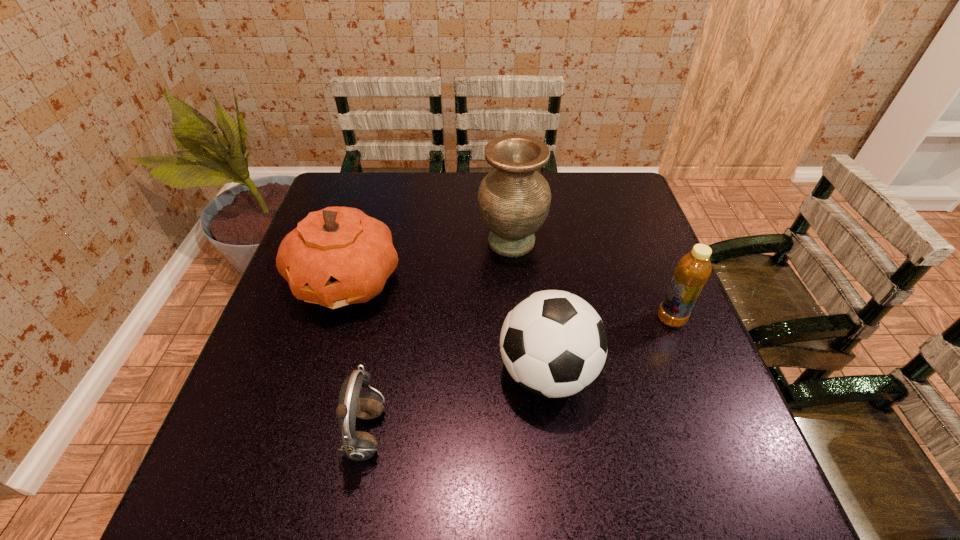
Where is `object that is at the near edge`? object that is at the near edge is located at coordinates (356, 445).

At what (x,y) coordinates should I click in order to perform the action: click on object situated at the left edge. Please return your answer as a coordinate pair (x, y). This screenshot has height=540, width=960. Looking at the image, I should click on (338, 256).

The image size is (960, 540). Find the location of `object that is at the right edge`. object that is at the right edge is located at coordinates (693, 270).

This screenshot has width=960, height=540. In the image, there is a desktop. What are the coordinates of `vacant space at the far edge` in the screenshot? It's located at click(x=566, y=199).

In the image, there is a desktop. Where is `blank space at the near edge`? Image resolution: width=960 pixels, height=540 pixels. blank space at the near edge is located at coordinates (388, 489).

What are the coordinates of `vacant area at the left edge of the desktop` in the screenshot? It's located at (252, 429).

Find the location of a particular element. This screenshot has height=540, width=960. free point at the far left corner is located at coordinates (354, 176).

Where is `blank space at the near left corner`? blank space at the near left corner is located at coordinates (261, 464).

Identify the location of blank space at the far right corner of the desktop. This screenshot has width=960, height=540. (629, 187).

This screenshot has height=540, width=960. I want to click on free space between the vase and the pumpkin, so click(x=429, y=261).